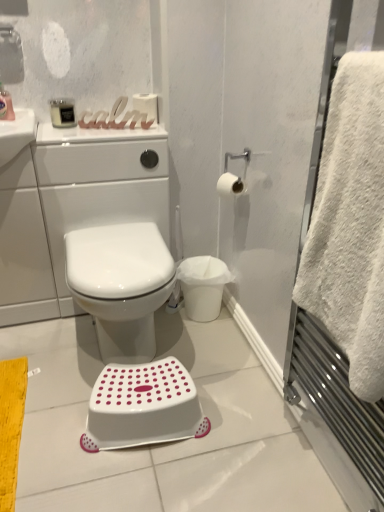
Question: Is white glossy toilet at center taller or shorter than white matte toilet paper at upper right, arranged as the 2th toilet paper when viewed from the top?

Choices:
 (A) short
 (B) tall

Answer: (B)

Question: Considering the positions of white glossy toilet at center and white matte toilet paper at upper right, which appears as the second toilet paper when viewed from the back, in the image, is white glossy toilet at center wider or thinner than white matte toilet paper at upper right, which appears as the second toilet paper when viewed from the back,?

Choices:
 (A) wide
 (B) thin

Answer: (A)

Question: Which object is the closest to the white plastic step stool at center?

Choices:
 (A) white fluffy towel at right
 (B) white glossy toilet at center
 (C) white matte toilet paper at upper right, marked as the first toilet paper in a bottom-to-top arrangement
 (D) matte black device at upper left, which is the first toiletry in right-to-left order
 (E) white matte toilet paper at upper center, which appears as the first toilet paper when viewed from the top

Answer: (A)

Question: Which is nearer to the matte black soap dispenser at upper left, the second toiletry when ordered from right to left?

Choices:
 (A) white matte toilet paper at upper center, acting as the 2th toilet paper starting from the front
 (B) white plastic step stool at center
 (C) white fluffy towel at right
 (D) matte black device at upper left, arranged as the 2th toiletry when viewed from the left
 (E) white matte toilet paper at upper right, the first toilet paper when ordered from right to left

Answer: (D)